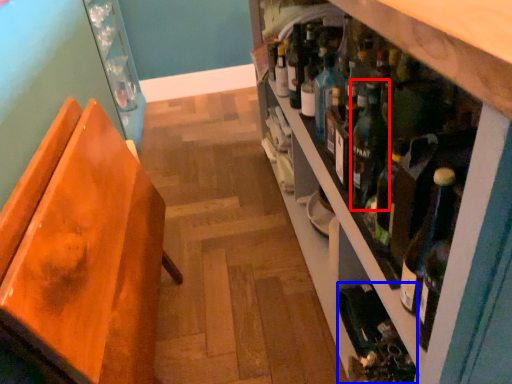
Question: Which of the following is the farthest to the observer, wine (highlighted by a red box) or wine bottle (highlighted by a blue box)?

Choices:
 (A) wine
 (B) wine bottle

Answer: (B)